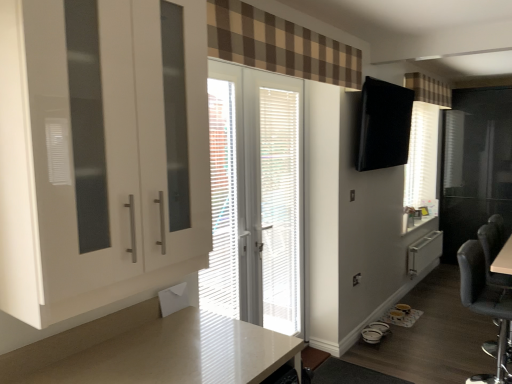
Where is `vacant space behind black fabric chair at lower right`? This screenshot has width=512, height=384. vacant space behind black fabric chair at lower right is located at coordinates (451, 357).